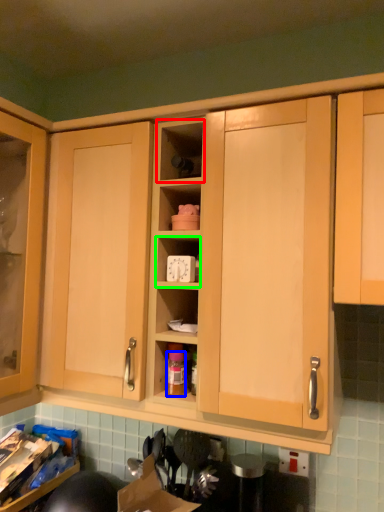
Question: Which is nearer to the shelf (highlighted by a red box)? bottle (highlighted by a blue box) or cabinet (highlighted by a green box).

Choices:
 (A) bottle
 (B) cabinet

Answer: (B)